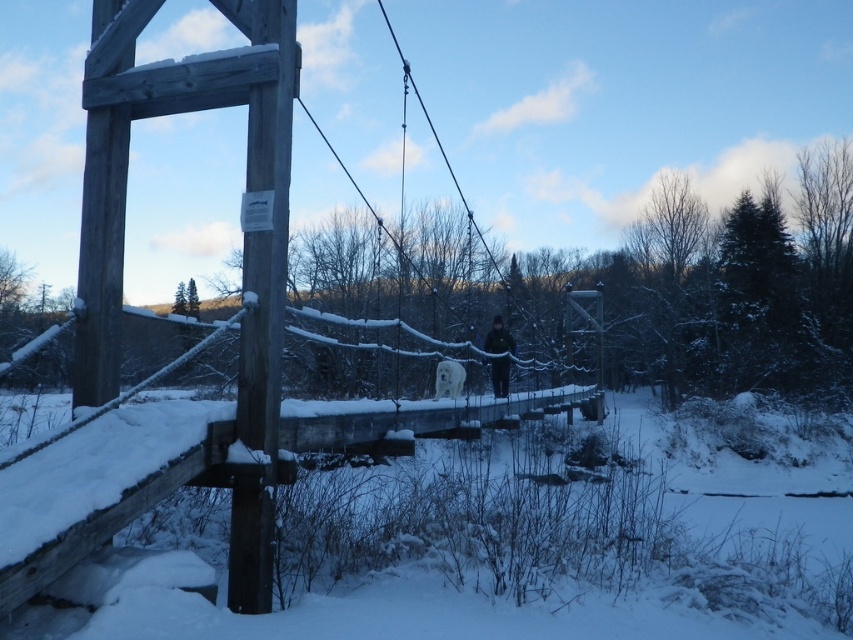
You are standing on the wooden suspension bridge at center and see the dark brown jacket at center. Which object is located higher in the scene?

The wooden suspension bridge at center is located higher than the dark brown jacket at center.

You are standing on the wooden suspension bridge at center and notice a dark brown jacket at center nearby. Which object appears larger in the image?

The dark brown jacket at center appears larger than the wooden suspension bridge at center in the image.